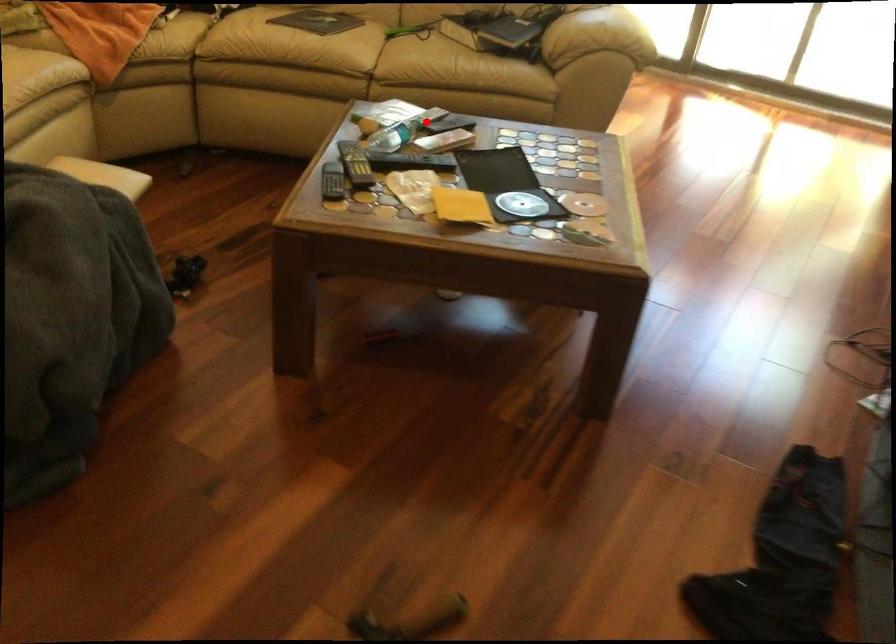
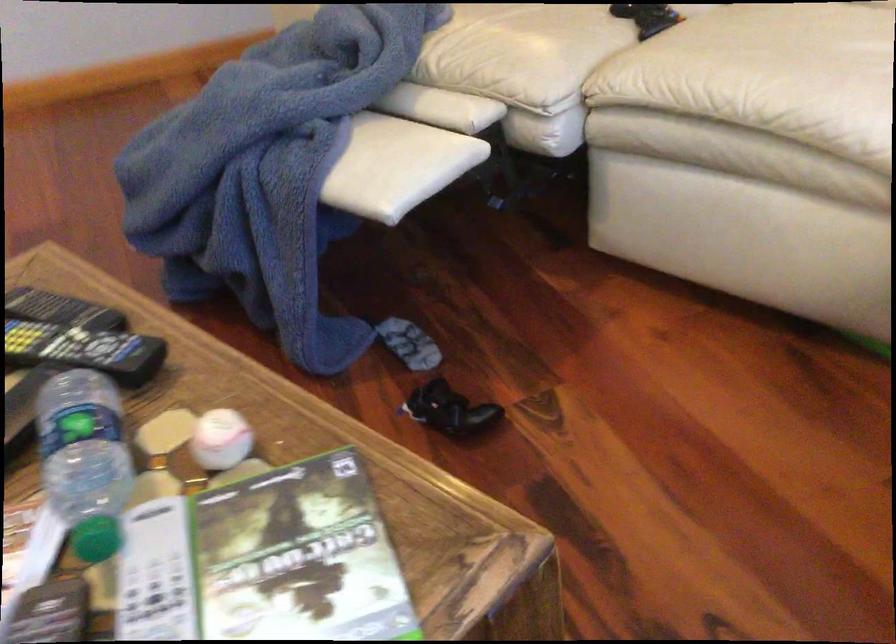
Question: I am providing you with two images of the same scene from different viewpoints. A red point is shown in image1. For the corresponding object point in image2, is it positioned nearer or farther from the camera?

Choices:
 (A) Nearer
 (B) Farther

Answer: (A)